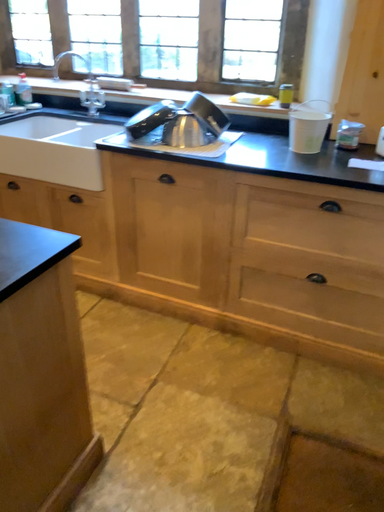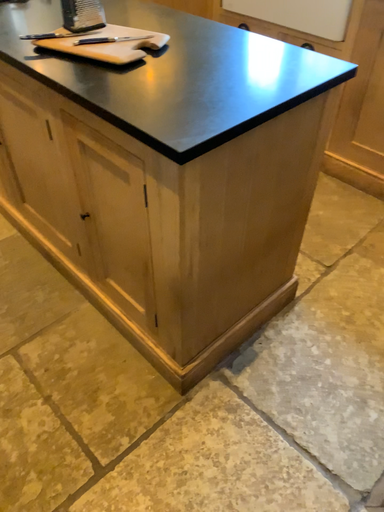
Question: How did the camera likely rotate when shooting the video?

Choices:
 (A) rotated upward
 (B) rotated downward

Answer: (B)